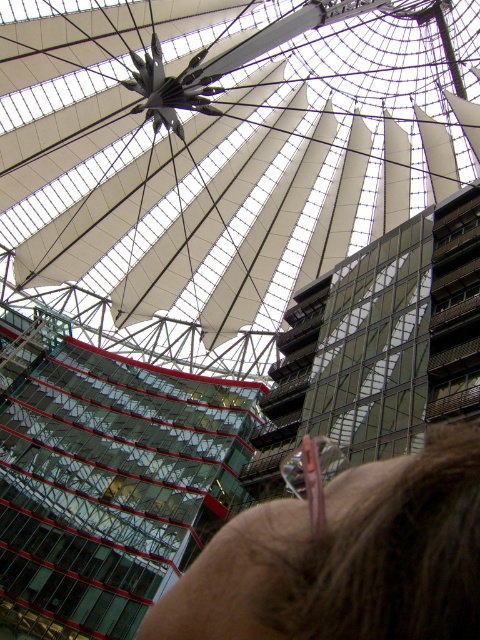
You are an architect analyzing the structural integrity of the white fabric roof at center and the brown hair at upper center. Which object would you prioritize for inspection if you need to check the larger one first?

The white fabric roof at center is larger in size than the brown hair at upper center, so you should prioritize inspecting the white fabric roof at center first.

Consider the image. You are a visitor standing in the center of the modern architectural structure. You notice the brown hair at upper center and the white fabric roof at center. Which object is closer to you?

The white fabric roof at center is closer to you because the brown hair at upper center is behind it.

You are an architect analyzing the structural integrity of the white fabric roof at center and the brown hair at upper center. Which object is significantly taller and might require additional support?

The white fabric roof at center is much taller than the brown hair at upper center, so it might require additional support due to its height.